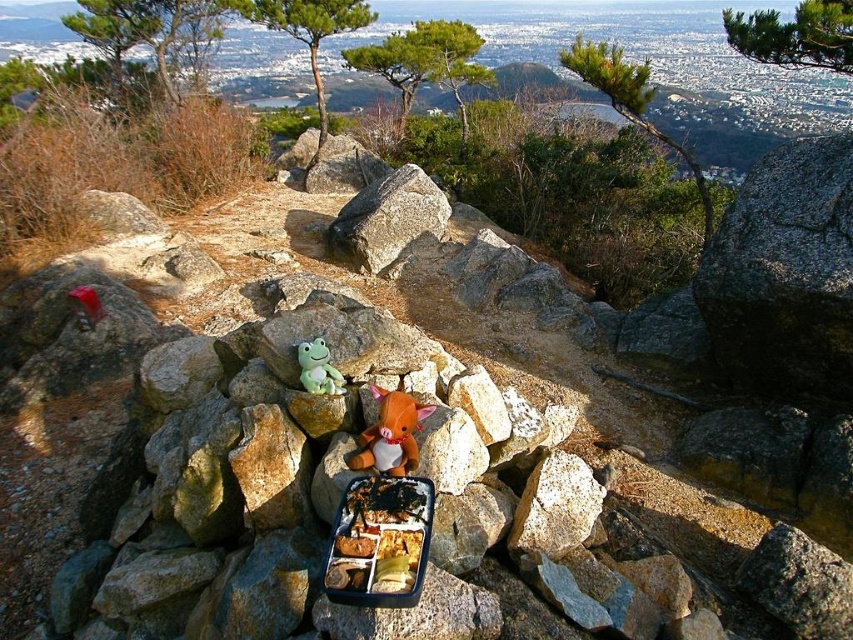
Question: Which point is closer to the camera?

Choices:
 (A) brown plush toy at center
 (B) gray rough rock at center
 (C) gray granite rock at center

Answer: (A)

Question: Can you confirm if gray granite rock at center is positioned above gray rough rock at center?

Choices:
 (A) yes
 (B) no

Answer: (B)

Question: Which point is farther to the camera?

Choices:
 (A) (815, 230)
 (B) (422, 204)
 (C) (323, 342)

Answer: (B)

Question: Among these objects, which one is farthest from the camera?

Choices:
 (A) brown plush toy at center
 (B) gray granite rock at center
 (C) green plush frog at center

Answer: (B)

Question: Is gray granite rock at center wider than gray rough rock at center?

Choices:
 (A) yes
 (B) no

Answer: (B)

Question: Can you confirm if gray rough rock at center is thinner than brown plush toy at center?

Choices:
 (A) yes
 (B) no

Answer: (B)